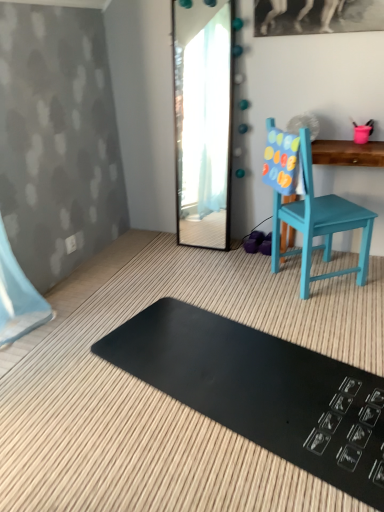
Question: Can clear glass mirror at center be found inside teal painted wood chair at right?

Choices:
 (A) yes
 (B) no

Answer: (B)

Question: Is the position of teal painted wood chair at right less distant than that of clear glass mirror at center?

Choices:
 (A) no
 (B) yes

Answer: (B)

Question: From the image's perspective, would you say teal painted wood chair at right is shown under clear glass mirror at center?

Choices:
 (A) yes
 (B) no

Answer: (A)

Question: Considering the relative sizes of teal painted wood chair at right and clear glass mirror at center in the image provided, is teal painted wood chair at right thinner than clear glass mirror at center?

Choices:
 (A) yes
 (B) no

Answer: (B)

Question: Would you say teal painted wood chair at right is outside clear glass mirror at center?

Choices:
 (A) yes
 (B) no

Answer: (A)

Question: Is teal painted wood chair at right to the left or to the right of clear glass mirror at center in the image?

Choices:
 (A) right
 (B) left

Answer: (A)

Question: From the image's perspective, is teal painted wood chair at right above or below clear glass mirror at center?

Choices:
 (A) below
 (B) above

Answer: (A)

Question: Considering the positions of teal painted wood chair at right and clear glass mirror at center in the image, is teal painted wood chair at right bigger or smaller than clear glass mirror at center?

Choices:
 (A) big
 (B) small

Answer: (A)

Question: Is point (309, 206) positioned closer to the camera than point (213, 242)?

Choices:
 (A) farther
 (B) closer

Answer: (B)

Question: From a real-world perspective, relative to teal painted wood changing table at right, is teal painted wood chair at right vertically above or below?

Choices:
 (A) above
 (B) below

Answer: (A)

Question: Is teal painted wood chair at right inside or outside of teal painted wood changing table at right?

Choices:
 (A) outside
 (B) inside

Answer: (A)

Question: In terms of height, does teal painted wood chair at right look taller or shorter compared to teal painted wood changing table at right?

Choices:
 (A) tall
 (B) short

Answer: (A)

Question: In terms of size, does teal painted wood chair at right appear bigger or smaller than teal painted wood changing table at right?

Choices:
 (A) small
 (B) big

Answer: (B)

Question: Is clear glass mirror at center situated inside teal painted wood changing table at right or outside?

Choices:
 (A) outside
 (B) inside

Answer: (A)

Question: Is clear glass mirror at center wider or thinner than teal painted wood changing table at right?

Choices:
 (A) thin
 (B) wide

Answer: (A)